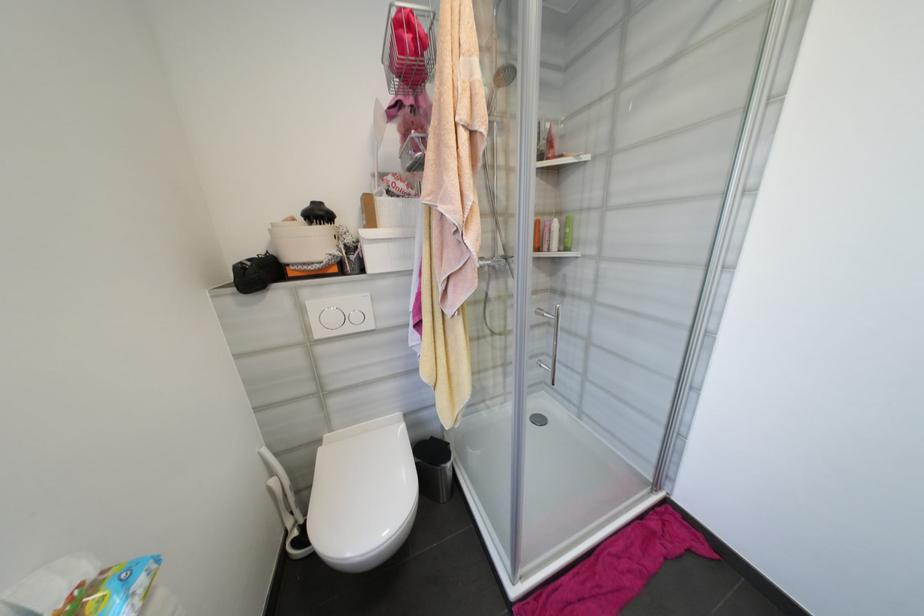
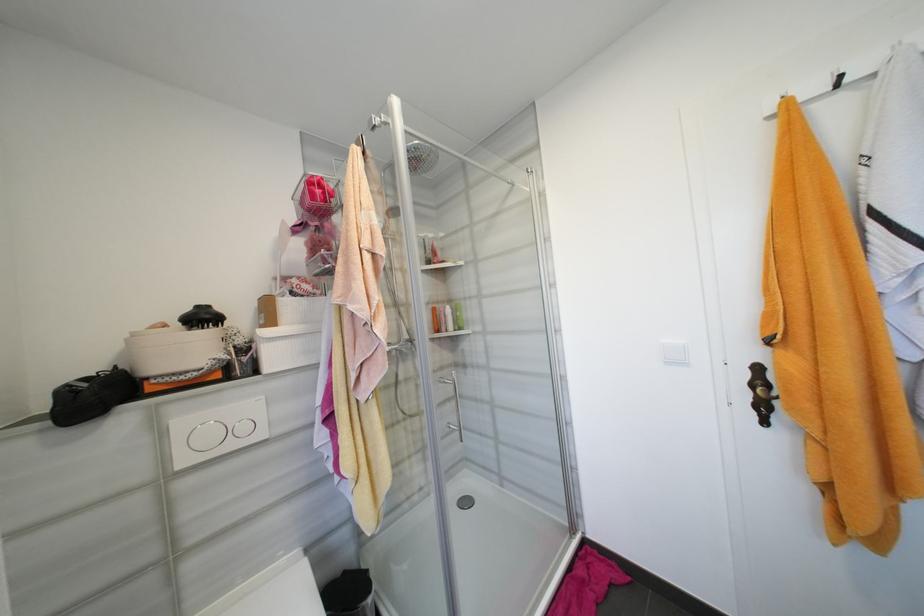
Find the pixel in the second image that matches pixel 438 440 in the first image.

(350, 573)